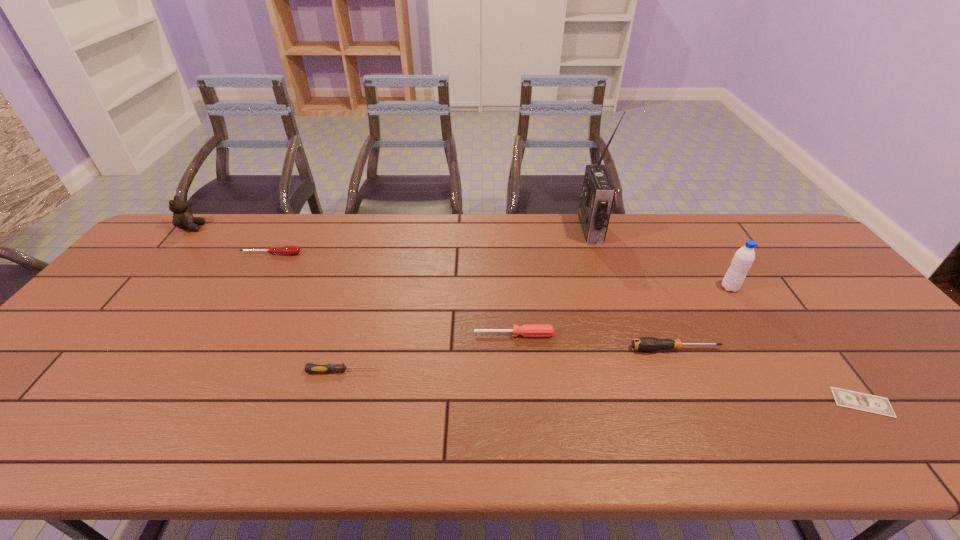
Where is `vacant region located 0.240m on the front of the third farthest screwdriver`? The width and height of the screenshot is (960, 540). vacant region located 0.240m on the front of the third farthest screwdriver is located at coordinates (717, 446).

Where is `free region located 0.180m on the left of the farthest screwdriver`? The width and height of the screenshot is (960, 540). free region located 0.180m on the left of the farthest screwdriver is located at coordinates (183, 254).

Find the location of a particular element. Image resolution: width=960 pixels, height=540 pixels. free space located 0.360m on the left of the fifth farthest object is located at coordinates click(335, 334).

This screenshot has height=540, width=960. I want to click on free space located 0.150m insert the nearest screwdriver into a screw head, so click(440, 371).

In order to click on blank space located on the back of the shortest object in this screenshot , I will do `click(779, 290)`.

Locate an element on the screen. radio receiver located in the far edge section of the desktop is located at coordinates (598, 192).

The height and width of the screenshot is (540, 960). Find the location of `teddy bear that is at the far edge`. teddy bear that is at the far edge is located at coordinates 182,217.

I want to click on screwdriver at the far edge, so click(x=288, y=250).

Locate an element on the screen. The image size is (960, 540). object located at the near edge is located at coordinates (845, 398).

Identify the location of object positioned at the left edge. (182, 217).